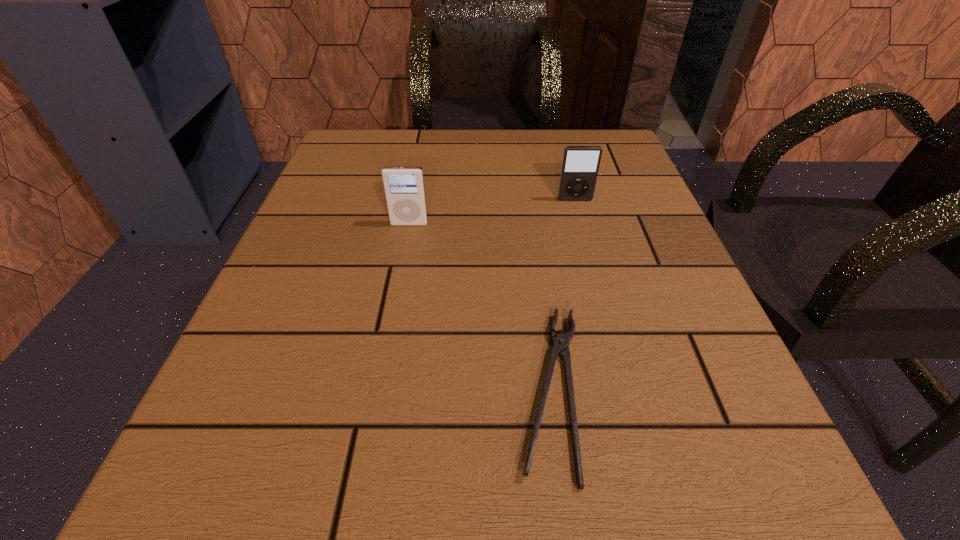
Identify the location of vacant area that lies between the second nearest object and the rightmost object. This screenshot has width=960, height=540. (492, 212).

You are a GUI agent. You are given a task and a screenshot of the screen. Output one action in this format:
    pyautogui.click(x=<x>, y=<y>)
    Task: Click on the blank region between the second nearest object and the rightmost object
    
    Given the screenshot: What is the action you would take?
    (x=492, y=212)

This screenshot has height=540, width=960. Identify the location of free space between the leftmost object and the rightmost object. [x=492, y=212].

Identify the location of vacant area that lies between the second farthest object and the right iPod. (492, 212).

The width and height of the screenshot is (960, 540). What are the coordinates of `free area in between the farthest object and the nearest object` in the screenshot? It's located at (563, 295).

The image size is (960, 540). In order to click on vacant area that lies between the second nearest object and the farther iPod in this screenshot , I will do `click(492, 212)`.

This screenshot has width=960, height=540. Find the location of `vacant region between the tongs and the right iPod`. vacant region between the tongs and the right iPod is located at coordinates (563, 295).

Image resolution: width=960 pixels, height=540 pixels. What are the coordinates of `unoccupied area between the second nearest object and the tongs` in the screenshot? It's located at (480, 307).

This screenshot has width=960, height=540. I want to click on unoccupied area between the leftmost object and the right iPod, so click(492, 212).

Where is `object that is the second closest one to the farther iPod`? The width and height of the screenshot is (960, 540). object that is the second closest one to the farther iPod is located at coordinates (560, 343).